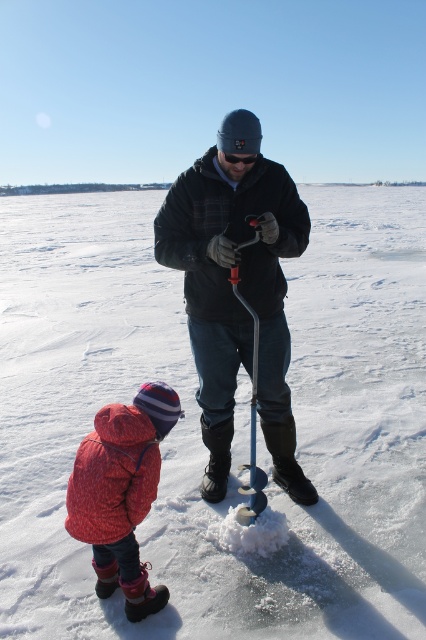
Question: Is white powdery snow at center to the right of fluffy pink coat at lower left from the viewer's perspective?

Choices:
 (A) no
 (B) yes

Answer: (B)

Question: From the image, what is the correct spatial relationship of fluffy pink coat at lower left in relation to metallic blue ski pole at center?

Choices:
 (A) right
 (B) left

Answer: (B)

Question: Which is farther from the matte black jacket at center?

Choices:
 (A) fluffy pink coat at lower left
 (B) white powdery snow at center
 (C) metallic blue ski pole at center

Answer: (B)

Question: Which point is farther to the camera?

Choices:
 (A) white powdery snow at center
 (B) metallic blue ski pole at center
 (C) matte black jacket at center
 (D) fluffy pink coat at lower left

Answer: (C)

Question: Is the position of white powdery snow at center more distant than that of fluffy pink coat at lower left?

Choices:
 (A) no
 (B) yes

Answer: (B)

Question: Which object is positioned closest to the metallic blue ski pole at center?

Choices:
 (A) fluffy pink coat at lower left
 (B) white powdery snow at center
 (C) matte black jacket at center

Answer: (C)